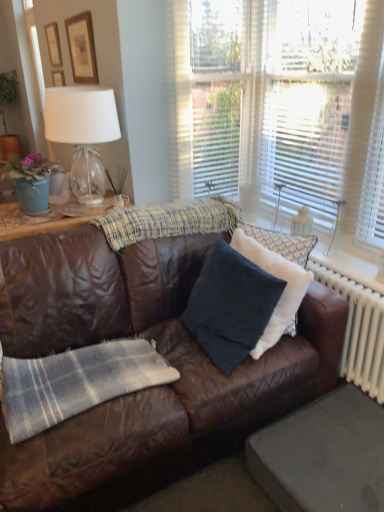
Question: From the image's perspective, is dark blue fabric pillow at center, which is the 1th pillow in left-to-right order, beneath wooden picture frame at upper left, the 1th picture frame viewed from the back?

Choices:
 (A) no
 (B) yes

Answer: (B)

Question: Is dark blue fabric pillow at center, which is the 1th pillow in left-to-right order, wider than wooden picture frame at upper left, arranged as the 1th picture frame when viewed from the left?

Choices:
 (A) yes
 (B) no

Answer: (A)

Question: Is the depth of dark blue fabric pillow at center, which is the 2th pillow from right to left, greater than that of wooden picture frame at upper left, the 2th picture frame from the right?

Choices:
 (A) yes
 (B) no

Answer: (B)

Question: Is dark blue fabric pillow at center, which is the 1th pillow in left-to-right order, taller than wooden picture frame at upper left, the 2th picture frame from the right?

Choices:
 (A) no
 (B) yes

Answer: (B)

Question: Considering the relative sizes of dark blue fabric pillow at center, which is the 1th pillow in left-to-right order, and wooden picture frame at upper left, the 1th picture frame viewed from the back, in the image provided, is dark blue fabric pillow at center, which is the 1th pillow in left-to-right order, bigger than wooden picture frame at upper left, the 1th picture frame viewed from the back,?

Choices:
 (A) yes
 (B) no

Answer: (A)

Question: Considering the positions of wooden picture frame at upper left, the 2th picture frame in the left-to-right sequence, and knitted woolen blanket at center in the image, is wooden picture frame at upper left, the 2th picture frame in the left-to-right sequence, wider or thinner than knitted woolen blanket at center?

Choices:
 (A) wide
 (B) thin

Answer: (B)

Question: Relative to knitted woolen blanket at center, is wooden picture frame at upper left, the 2th picture frame in the left-to-right sequence, in front or behind?

Choices:
 (A) front
 (B) behind

Answer: (B)

Question: From the image's perspective, relative to knitted woolen blanket at center, is wooden picture frame at upper left, which appears as the 1th picture frame when viewed from the right, above or below?

Choices:
 (A) above
 (B) below

Answer: (A)

Question: Would you say wooden picture frame at upper left, the 2th picture frame in the left-to-right sequence, is to the left or to the right of knitted woolen blanket at center in the picture?

Choices:
 (A) right
 (B) left

Answer: (B)

Question: From a real-world perspective, is white textured curtain at upper right physically located above or below brown leather couch at center?

Choices:
 (A) above
 (B) below

Answer: (A)

Question: Based on their positions, is white textured curtain at upper right located to the left or right of brown leather couch at center?

Choices:
 (A) left
 (B) right

Answer: (B)

Question: From the image's perspective, relative to brown leather couch at center, is white textured curtain at upper right above or below?

Choices:
 (A) above
 (B) below

Answer: (A)

Question: Looking at their shapes, would you say white textured curtain at upper right is wider or thinner than brown leather couch at center?

Choices:
 (A) wide
 (B) thin

Answer: (B)

Question: Based on their positions, is white textured curtain at upper right located to the left or right of white plastic radiator at right?

Choices:
 (A) left
 (B) right

Answer: (A)

Question: Is white textured curtain at upper right bigger or smaller than white plastic radiator at right?

Choices:
 (A) small
 (B) big

Answer: (B)